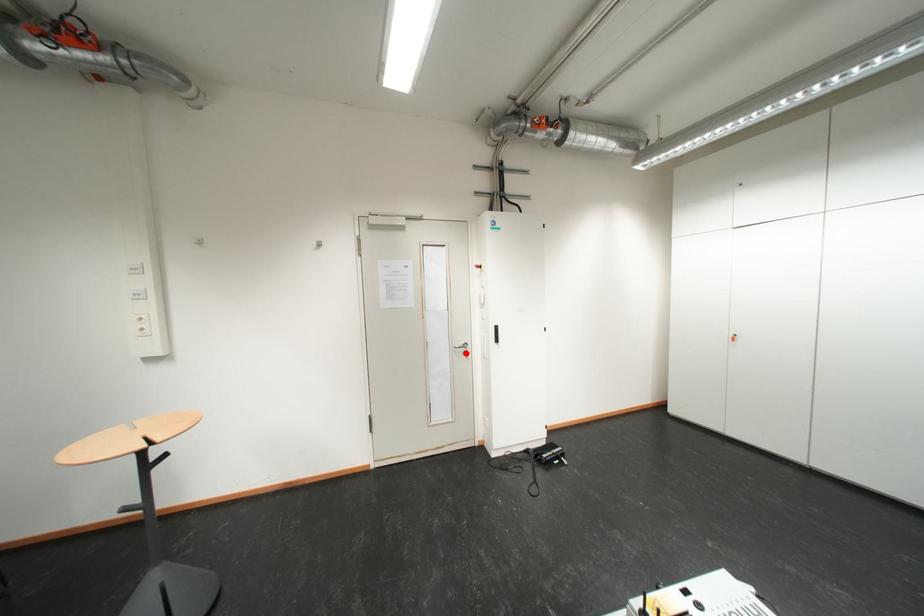
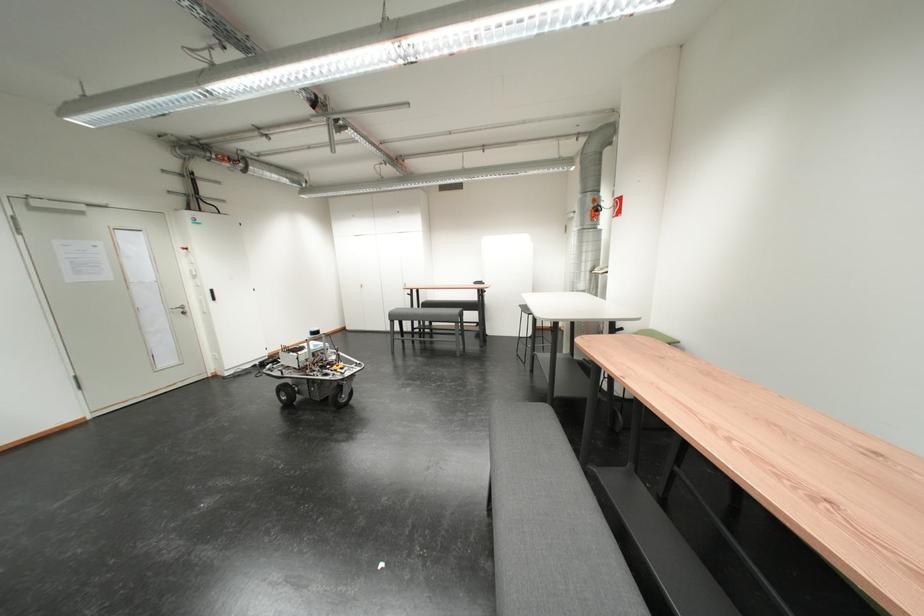
Where in the second image is the point corresponding to the highlighted location from the first image?

(184, 314)